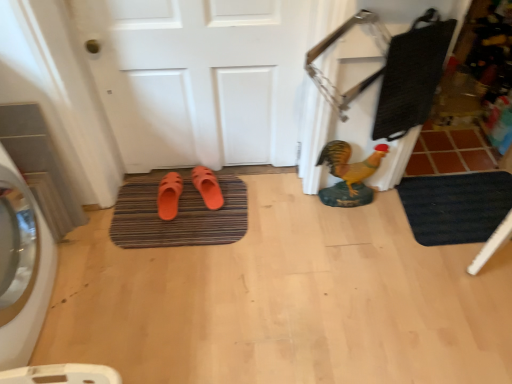
Find the location of a particular element. This screenshot has height=384, width=512. free area in between orange rubber slipper at center, marked as the 2th footwear in a right-to-left arrangement, and orange rubber slipper at center, marked as the 2th footwear in a left-to-right arrangement is located at coordinates (187, 204).